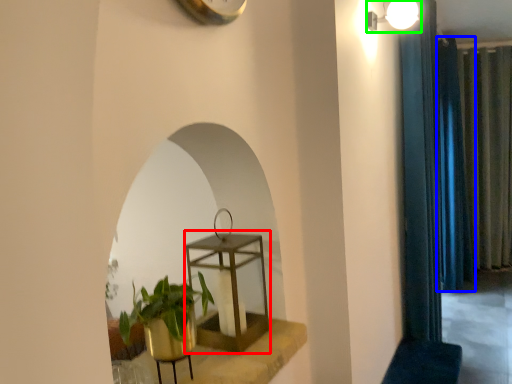
Question: Estimate the real-world distances between objects in this image. Which object is farther from round table (highlighted by a red box), curtain (highlighted by a blue box) or light fixture (highlighted by a green box)?

Choices:
 (A) curtain
 (B) light fixture

Answer: (A)